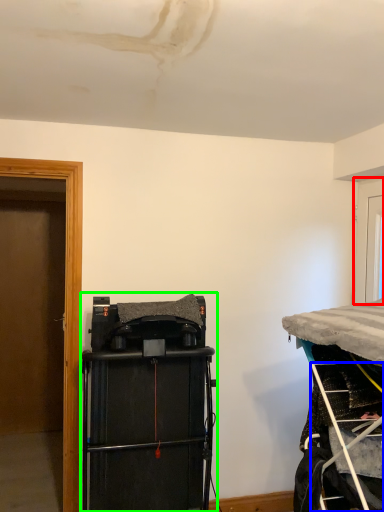
Question: Estimate the real-world distances between objects in this image. Which object is closer to door (highlighted by a red box), ladder (highlighted by a blue box) or equipment (highlighted by a green box)?

Choices:
 (A) ladder
 (B) equipment

Answer: (A)